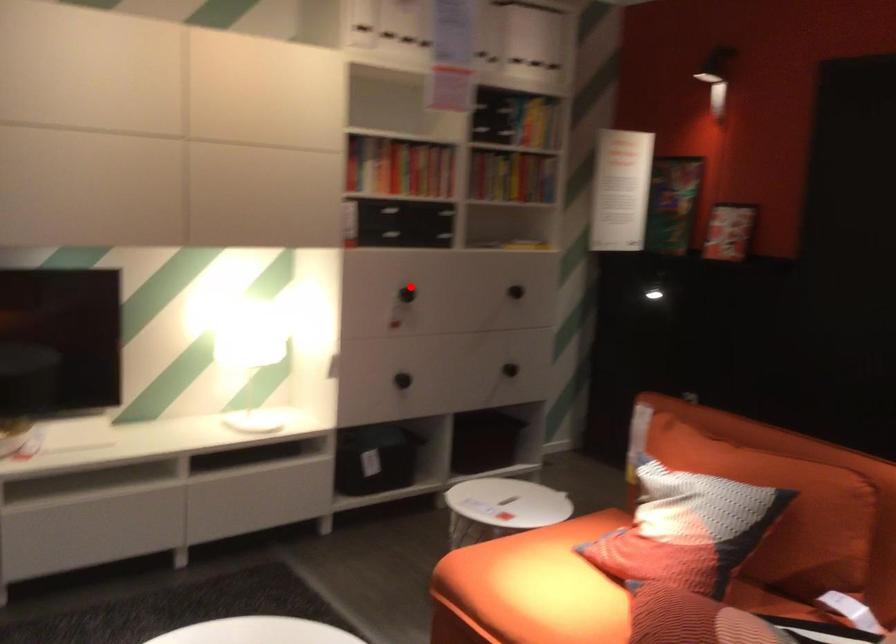
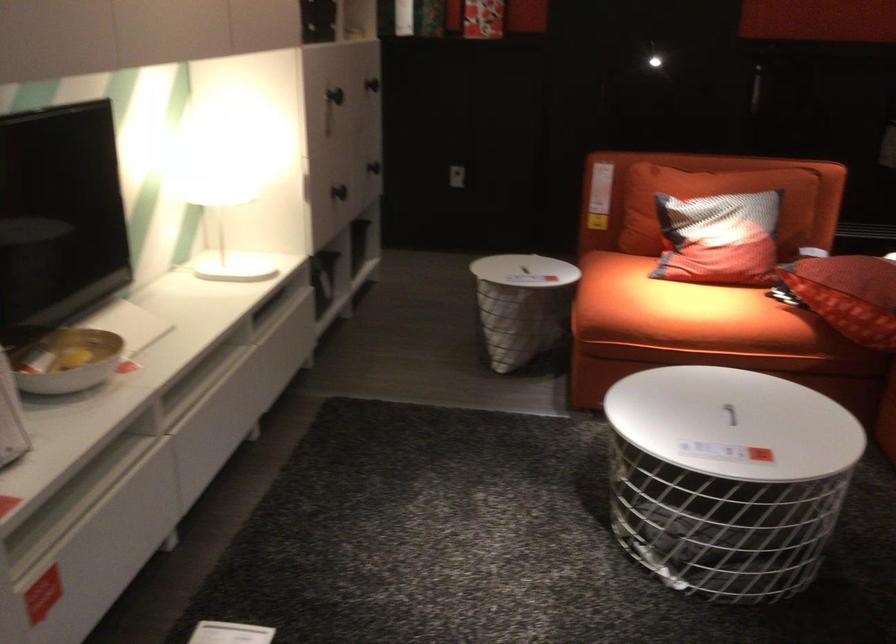
In the second image, find the point that corresponds to the highlighted location in the first image.

(334, 95)